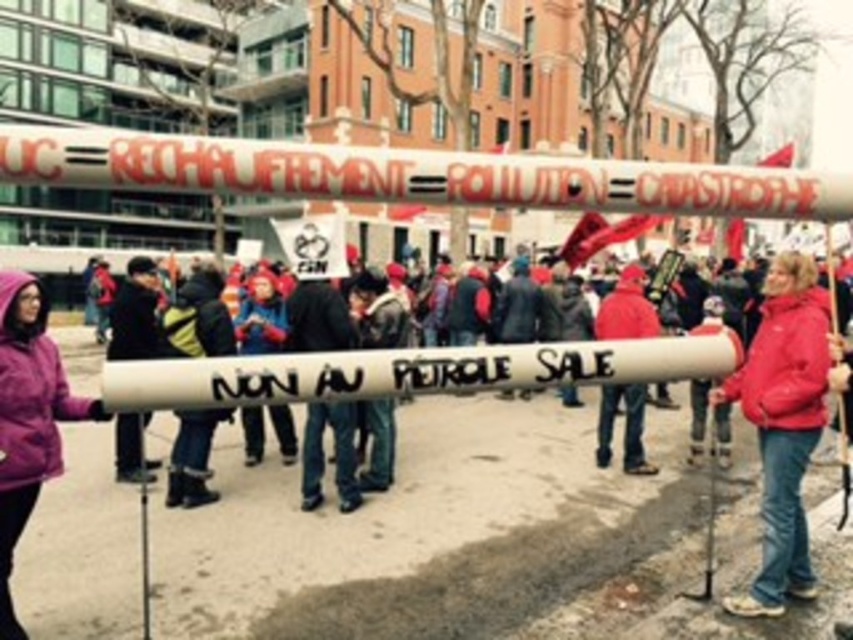
Which of these two, red fleece jacket at lower right or purple fleece jacket at left, stands taller?

With more height is purple fleece jacket at left.

Between red fleece jacket at lower right and purple fleece jacket at left, which one is positioned lower?

purple fleece jacket at left

Is point (805, 321) closer to camera compared to point (55, 436)?

No, (805, 321) is behind (55, 436).

Locate an element on the screen. This screenshot has width=853, height=640. red fleece jacket at lower right is located at coordinates (782, 424).

Between purple fleece jacket at left and red woolen hat at center, which one appears on the right side from the viewer's perspective?

red woolen hat at center

Which is below, purple fleece jacket at left or red woolen hat at center?

purple fleece jacket at left is below.

Locate an element on the screen. The height and width of the screenshot is (640, 853). purple fleece jacket at left is located at coordinates (28, 419).

Between red fleece jacket at lower right and red woolen hat at center, which one appears on the right side from the viewer's perspective?

red fleece jacket at lower right is more to the right.

This screenshot has height=640, width=853. Describe the element at coordinates (782, 424) in the screenshot. I see `red fleece jacket at lower right` at that location.

The height and width of the screenshot is (640, 853). Identify the location of red fleece jacket at lower right. (782, 424).